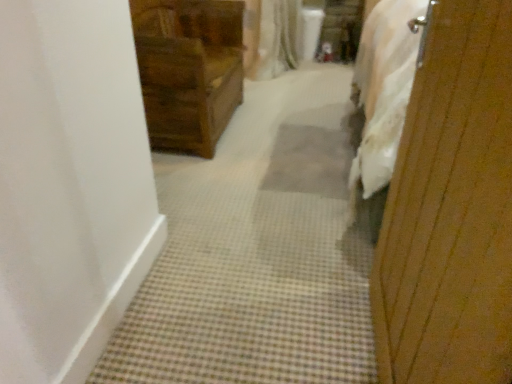
The image size is (512, 384). What do you see at coordinates (189, 70) in the screenshot? I see `wooden chest of drawers at upper left` at bounding box center [189, 70].

Where is `wooden chest of drawers at upper left`? Image resolution: width=512 pixels, height=384 pixels. wooden chest of drawers at upper left is located at coordinates (189, 70).

Locate an element on the screen. The height and width of the screenshot is (384, 512). wooden screen door at right is located at coordinates (451, 209).

What do you see at coordinates (451, 209) in the screenshot? I see `wooden screen door at right` at bounding box center [451, 209].

You are a GUI agent. You are given a task and a screenshot of the screen. Output one action in this format:
    pyautogui.click(x=<x>, y=<y>)
    Task: Click on the wooden chest of drawers at upper left
    Image resolution: width=512 pixels, height=384 pixels.
    Given the screenshot: What is the action you would take?
    pyautogui.click(x=189, y=70)

Does wooden chest of drawers at upper left appear on the right side of wooden screen door at right?

No, wooden chest of drawers at upper left is not to the right of wooden screen door at right.

In the image, is wooden chest of drawers at upper left positioned in front of or behind wooden screen door at right?

Clearly, wooden chest of drawers at upper left is behind wooden screen door at right.

Does point (178, 41) appear closer or farther from the camera than point (438, 133)?

Point (178, 41) is farther from the camera than point (438, 133).

From the image's perspective, is wooden chest of drawers at upper left located beneath wooden screen door at right?

Actually, wooden chest of drawers at upper left appears above wooden screen door at right in the image.

In the scene shown: From a real-world perspective, is wooden chest of drawers at upper left positioned under wooden screen door at right based on gravity?

Yes, from a real-world perspective, wooden chest of drawers at upper left is under wooden screen door at right.

Looking at this image, does wooden chest of drawers at upper left have a greater width compared to wooden screen door at right?

Yes, wooden chest of drawers at upper left is wider than wooden screen door at right.

Which of these two, wooden chest of drawers at upper left or wooden screen door at right, stands shorter?

wooden chest of drawers at upper left.

Who is smaller, wooden chest of drawers at upper left or wooden screen door at right?

With smaller size is wooden screen door at right.

Would you say wooden chest of drawers at upper left is inside or outside wooden screen door at right?

wooden chest of drawers at upper left is spatially situated outside wooden screen door at right.

Is wooden chest of drawers at upper left directly adjacent to wooden screen door at right?

No, wooden chest of drawers at upper left is not beside wooden screen door at right.

Is wooden chest of drawers at upper left positioned with its back to wooden screen door at right?

No, wooden chest of drawers at upper left is not facing the opposite direction of wooden screen door at right.

How different are the orientations of wooden chest of drawers at upper left and wooden screen door at right in degrees?

wooden chest of drawers at upper left and wooden screen door at right are facing 159 degrees away from each other.

Measure the distance from wooden chest of drawers at upper left to wooden screen door at right.

The distance of wooden chest of drawers at upper left from wooden screen door at right is 4.94 feet.

You are a GUI agent. You are given a task and a screenshot of the screen. Output one action in this format:
    pyautogui.click(x=<x>, y=<y>)
    Task: Click on the furniture that is under the wooden screen door at right (from a real-world perspective)
    This screenshot has height=384, width=512.
    Given the screenshot: What is the action you would take?
    pyautogui.click(x=189, y=70)

Considering the positions of objects wooden screen door at right and wooden chest of drawers at upper left in the image provided, who is more to the right, wooden screen door at right or wooden chest of drawers at upper left?

Positioned to the right is wooden screen door at right.

Does wooden screen door at right lie behind wooden chest of drawers at upper left?

That is False.

Between point (489, 250) and point (177, 24), which one is positioned behind?

The point (177, 24) is farther.

From the image's perspective, which one is positioned lower, wooden screen door at right or wooden chest of drawers at upper left?

wooden screen door at right is shown below in the image.

From a real-world perspective, between wooden screen door at right and wooden chest of drawers at upper left, who is vertically higher?

wooden screen door at right, from a real-world perspective.

Is wooden screen door at right wider than wooden chest of drawers at upper left?

In fact, wooden screen door at right might be narrower than wooden chest of drawers at upper left.

Which of these two, wooden screen door at right or wooden chest of drawers at upper left, stands taller?

wooden screen door at right is taller.

Considering the sizes of objects wooden screen door at right and wooden chest of drawers at upper left in the image provided, who is smaller, wooden screen door at right or wooden chest of drawers at upper left?

wooden screen door at right is smaller.

From the picture: Is wooden screen door at right situated inside wooden chest of drawers at upper left or outside?

wooden screen door at right exists outside the volume of wooden chest of drawers at upper left.

Is wooden screen door at right positioned far away from wooden chest of drawers at upper left?

wooden screen door at right is far away from wooden chest of drawers at upper left.

Is wooden screen door at right positioned with its back to wooden chest of drawers at upper left?

wooden screen door at right is not turned away from wooden chest of drawers at upper left.

What's the angular difference between wooden screen door at right and wooden chest of drawers at upper left's facing directions?

They differ by 159 degrees in their facing directions.

You are a GUI agent. You are given a task and a screenshot of the screen. Output one action in this format:
    pyautogui.click(x=<x>, y=<y>)
    Task: Click on the screen door on the right of wooden chest of drawers at upper left
    
    Given the screenshot: What is the action you would take?
    pyautogui.click(x=451, y=209)

Locate an element on the screen. This screenshot has height=384, width=512. screen door in front of the wooden chest of drawers at upper left is located at coordinates (451, 209).

This screenshot has height=384, width=512. Identify the location of screen door above the wooden chest of drawers at upper left (from a real-world perspective). (451, 209).